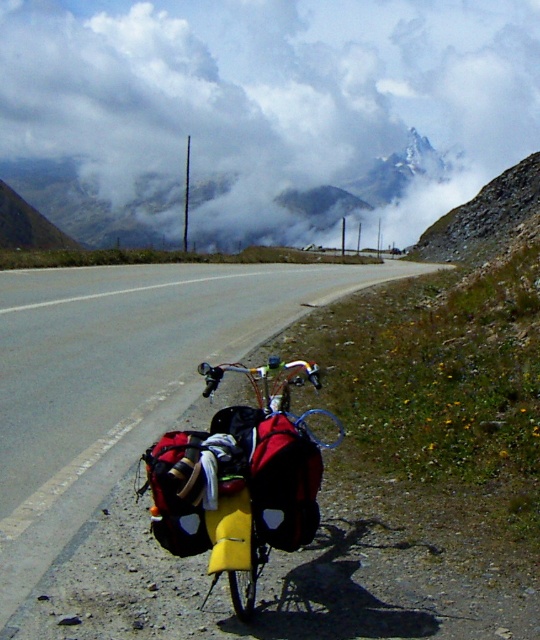
You are standing on the roadside and want to take a photo of the cloudy sky at upper center. According to the coordinates provided, where exactly should you aim your camera?

The cloudy sky at upper center is located at coordinates point [262,113], so aim your camera there.

You are a hiker standing on the roadside and want to take a photo of the cloudy sky at upper center and the yellow matte bag at center. Which object will appear bigger in your photo?

The cloudy sky at upper center will appear bigger in the photo because it has a larger size compared to the yellow matte bag at center.

You are a hiker standing on the roadside and want to place a marker exactly where the yellow matte bag at center is located. Based on the scene, will the marker be visible from under the cloudy sky at upper center?

The cloudy sky at upper center is positioned over the yellow matte bag at center, so the marker placed at the yellow matte bag at center would be visible from under the cloudy sky at upper center since the sky is above it.